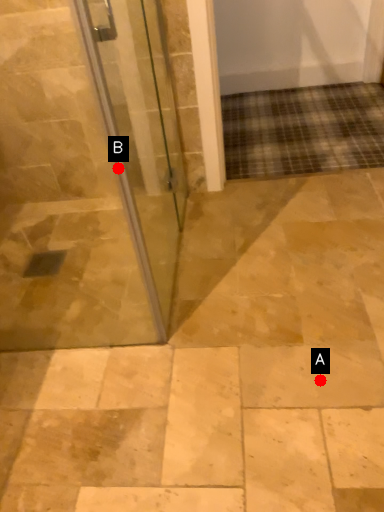
Question: Two points are circled on the image, labeled by A and B beside each circle. Which point is closer to the camera?

Choices:
 (A) A is closer
 (B) B is closer

Answer: (B)